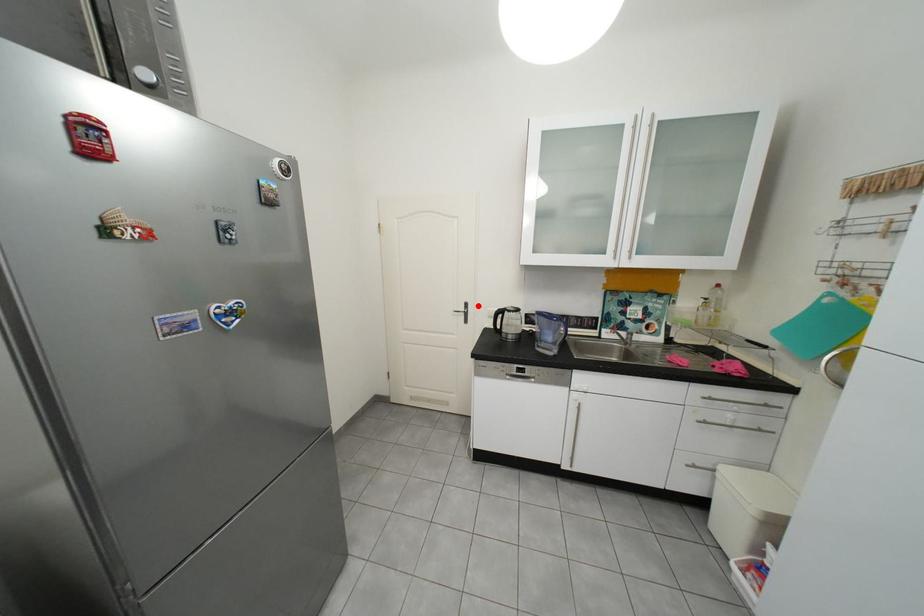
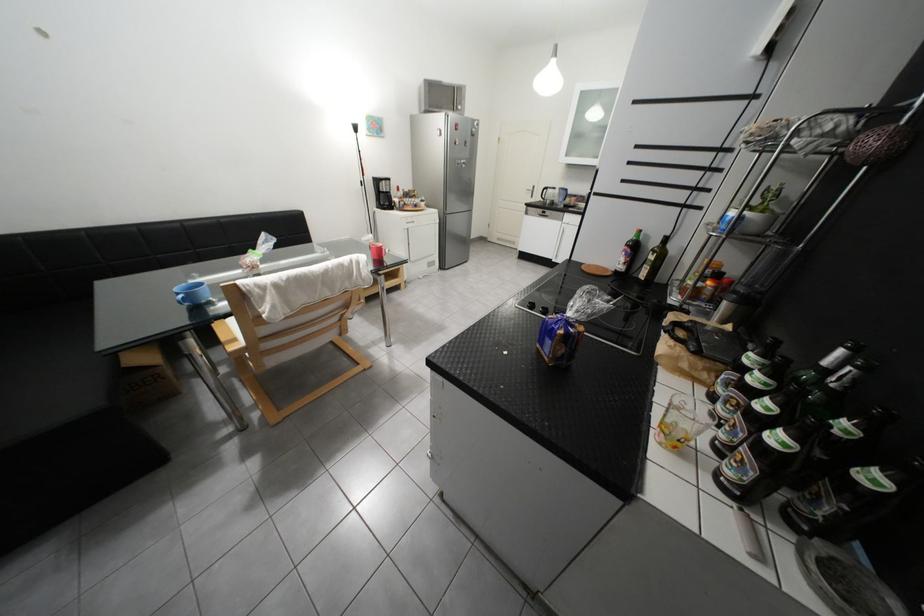
Question: I am providing you with two images of the same scene from different viewpoints. A red point is shown in image1. For the corresponding object point in image2, is it positioned nearer or farther from the camera?

Choices:
 (A) Nearer
 (B) Farther

Answer: (A)